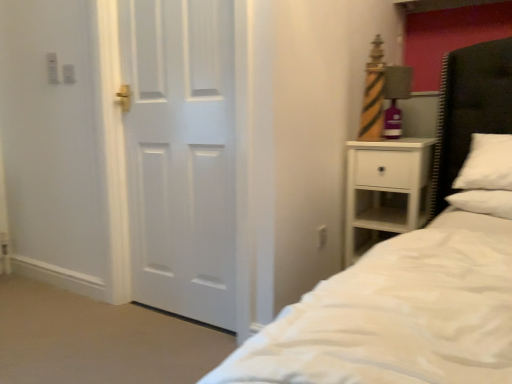
At what (x,y) coordinates should I click in order to perform the action: click on white glossy door at left. Please return your answer as a coordinate pair (x, y). Looking at the image, I should click on (181, 155).

In order to face white soft pillow at right, should I rotate leftwards or rightwards?

Rotate your view right by about 28.664°.

In order to face white matte nightstand at right, should I rotate leftwards or rightwards?

Turn right approximately 18.139 degrees to face it.

The image size is (512, 384). Describe the element at coordinates (469, 109) in the screenshot. I see `black leather headboard at right` at that location.

Where is `white glossy door at left`? white glossy door at left is located at coordinates (181, 155).

Is matte striped lamp at right not close to white soft pillow at right?

No, matte striped lamp at right is in close proximity to white soft pillow at right.

From a real-world perspective, who is located lower, matte striped lamp at right or white soft pillow at right?

white soft pillow at right is physically lower.

Could you tell me if matte striped lamp at right is facing white soft pillow at right?

No, matte striped lamp at right is not oriented towards white soft pillow at right.

In the image, is matte striped lamp at right positioned in front of or behind white soft pillow at right?

matte striped lamp at right is positioned farther from the viewer than white soft pillow at right.

Looking at this image, from the image's perspective, would you say black leather headboard at right is positioned over white glossy door at left?

Yes.

Does black leather headboard at right come in front of white glossy door at left?

No.

Is black leather headboard at right bigger than white glossy door at left?

Incorrect, black leather headboard at right is not larger than white glossy door at left.

Is black leather headboard at right oriented towards white glossy door at left?

No.

Considering the sizes of objects white matte nightstand at right and black leather headboard at right in the image provided, who is shorter, white matte nightstand at right or black leather headboard at right?

With less height is black leather headboard at right.

Looking at this image, does white matte nightstand at right appear on the left side of black leather headboard at right?

Correct, you'll find white matte nightstand at right to the left of black leather headboard at right.

From the image's perspective, between white matte nightstand at right and black leather headboard at right, who is located below?

white matte nightstand at right, from the image's perspective.

Is white matte nightstand at right touching black leather headboard at right?

No, white matte nightstand at right is not beside black leather headboard at right.

Based on the photo, considering the relative sizes of matte striped lamp at right and black leather headboard at right in the image provided, is matte striped lamp at right thinner than black leather headboard at right?

Yes, matte striped lamp at right is thinner than black leather headboard at right.

Is point (391, 92) closer to viewer compared to point (496, 97)?

Yes, point (391, 92) is in front of point (496, 97).

Can you tell me how much matte striped lamp at right and black leather headboard at right differ in facing direction?

1.35 degrees.

Is matte striped lamp at right next to black leather headboard at right and touching it?

No, matte striped lamp at right is not making contact with black leather headboard at right.

Considering the relative positions of matte striped lamp at right and white matte nightstand at right in the image provided, is matte striped lamp at right in front of white matte nightstand at right?

No, the depth of matte striped lamp at right is greater than that of white matte nightstand at right.

Can you confirm if matte striped lamp at right is taller than white matte nightstand at right?

No.

Is matte striped lamp at right facing towards white matte nightstand at right?

No, matte striped lamp at right is not aimed at white matte nightstand at right.

This screenshot has width=512, height=384. In order to click on lamp that appears on the left of white matte nightstand at right in this screenshot , I will do `click(395, 98)`.

This screenshot has width=512, height=384. Identify the location of door that is on the left side of white matte nightstand at right. (181, 155).

In the scene shown: From the image's perspective, would you say white glossy door at left is shown under white matte nightstand at right?

No, from the image's perspective, white glossy door at left is not below white matte nightstand at right.

Between white glossy door at left and white matte nightstand at right, which one has smaller width?

white glossy door at left is thinner.

Can you confirm if white soft pillow at right is shorter than white glossy door at left?

Yes.

Considering the relative sizes of white soft pillow at right and white glossy door at left in the image provided, is white soft pillow at right bigger than white glossy door at left?

No, white soft pillow at right is not bigger than white glossy door at left.

In the scene shown: Is white soft pillow at right aimed at white glossy door at left?

No, white soft pillow at right is not turned towards white glossy door at left.

Considering the points (498, 215) and (194, 166), which point is behind, point (498, 215) or point (194, 166)?

The point (194, 166) is behind.

Image resolution: width=512 pixels, height=384 pixels. Identify the location of lamp to the left of white soft pillow at right. (395, 98).

Where is `door in front of the black leather headboard at right`? This screenshot has width=512, height=384. door in front of the black leather headboard at right is located at coordinates (181, 155).

Estimate the real-world distances between objects in this image. Which object is further from white soft pillow at right, white glossy door at left or black leather headboard at right?

white glossy door at left is positioned further to the anchor white soft pillow at right.

When comparing their distances from white glossy door at left, does white matte nightstand at right or black leather headboard at right seem closer?

Among the two, white matte nightstand at right is located nearer to white glossy door at left.

When comparing their distances from white soft pillow at right, does white matte nightstand at right or white glossy door at left seem further?

white glossy door at left is positioned further to the anchor white soft pillow at right.

Based on their spatial positions, is white soft pillow at right or white glossy door at left further from black leather headboard at right?

white glossy door at left is further to black leather headboard at right.

From the image, which object appears to be farther from white glossy door at left, black leather headboard at right or white soft pillow at right?

The object further to white glossy door at left is black leather headboard at right.

When comparing their distances from white glossy door at left, does white soft pillow at right or black leather headboard at right seem further?

black leather headboard at right is positioned further to the anchor white glossy door at left.

When comparing their distances from white matte nightstand at right, does matte striped lamp at right or white glossy door at left seem closer?

matte striped lamp at right is positioned closer to the anchor white matte nightstand at right.

Considering their positions, is matte striped lamp at right positioned further to black leather headboard at right than white matte nightstand at right?

matte striped lamp at right is further to black leather headboard at right.

In order to click on lamp located between white glossy door at left and white matte nightstand at right in the left-right direction in this screenshot , I will do `click(395, 98)`.

The width and height of the screenshot is (512, 384). Identify the location of headboard between white matte nightstand at right and white soft pillow at right in the horizontal direction. (469, 109).

Find the location of a particular element. The height and width of the screenshot is (384, 512). nightstand between white glossy door at left and black leather headboard at right from left to right is located at coordinates (385, 187).

At what (x,y) coordinates should I click in order to perform the action: click on headboard between matte striped lamp at right and white matte nightstand at right in the vertical direction. Please return your answer as a coordinate pair (x, y). Image resolution: width=512 pixels, height=384 pixels. Looking at the image, I should click on (469, 109).